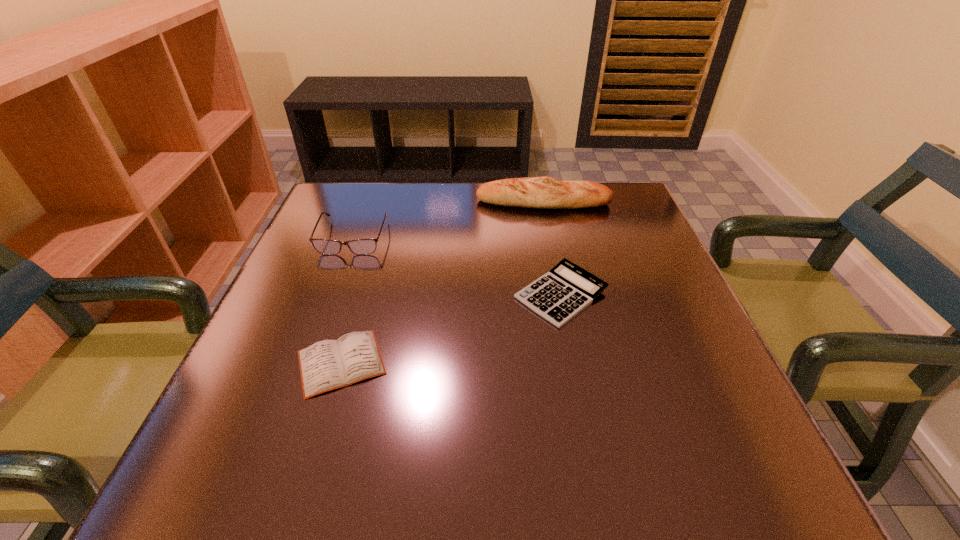
Identify the location of free space that satisfies the following two spatial constraints: 1. on the lenses of the spectacles; 2. on the right side of the third farthest object. This screenshot has height=540, width=960. (332, 294).

Locate an element on the screen. vacant space that satisfies the following two spatial constraints: 1. on the back side of the calculator; 2. on the left side of the diary is located at coordinates pyautogui.click(x=361, y=294).

Where is `vacant area that satisfies the following two spatial constraints: 1. on the lenses of the third shortest object; 2. on the right side of the diary`? This screenshot has height=540, width=960. vacant area that satisfies the following two spatial constraints: 1. on the lenses of the third shortest object; 2. on the right side of the diary is located at coordinates tap(307, 362).

In order to click on vacant space that satisfies the following two spatial constraints: 1. on the lenses of the third nearest object; 2. on the right side of the third tallest object in this screenshot , I will do `click(332, 294)`.